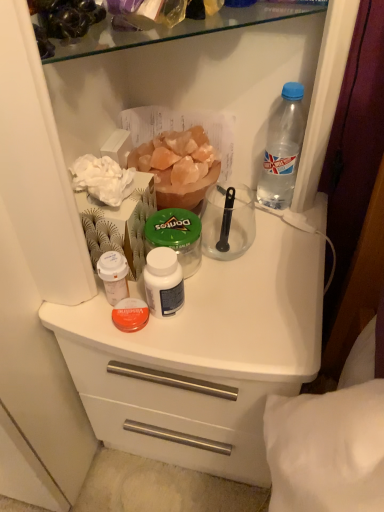
Identify the location of free location in front of transparent plastic bottle at upper right, arranged as the 1th bottle when viewed from the top. (271, 261).